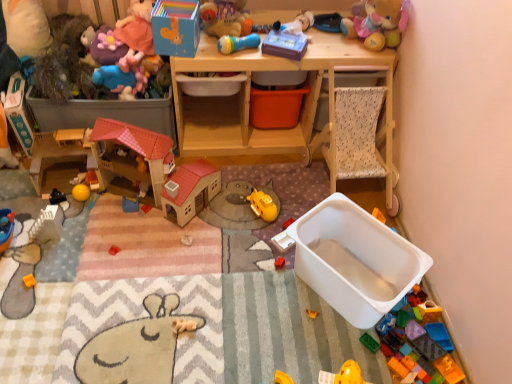
Locate an element on the screen. The width and height of the screenshot is (512, 384). spots to the right of white plastic toy at center, arranged as the third toy when viewed from the right is located at coordinates (333, 255).